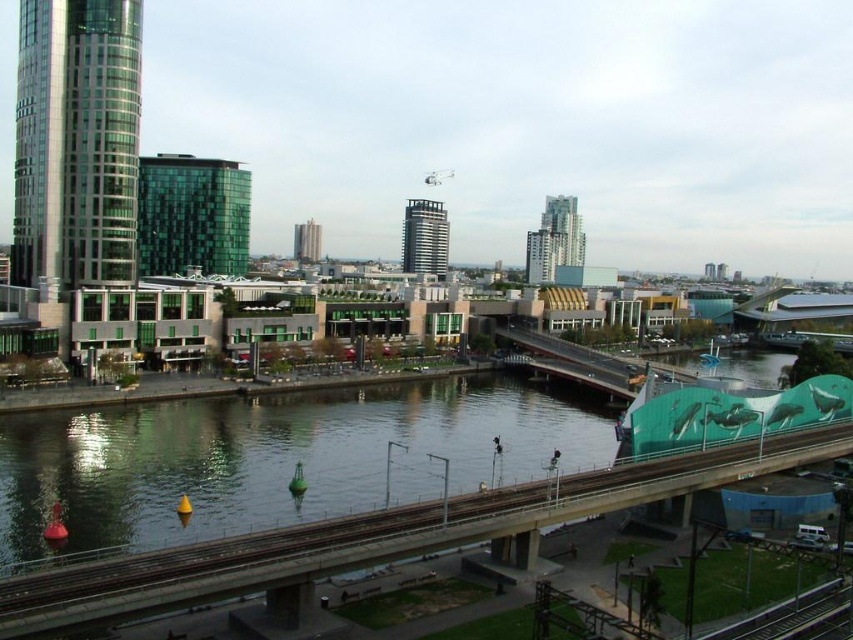
Find the location of a particular element. This screenshot has width=853, height=640. green glass building at upper left is located at coordinates (192, 216).

Which is more to the left, green glass building at upper left or green glass tower at center?

Positioned to the left is green glass tower at center.

Who is more distant from viewer, (x=155, y=198) or (x=310, y=228)?

The point (x=310, y=228) is behind.

You are a GUI agent. You are given a task and a screenshot of the screen. Output one action in this format:
    pyautogui.click(x=<x>, y=<y>)
    Task: Click on the green glass building at upper left
    The image size is (853, 640).
    Given the screenshot: What is the action you would take?
    pyautogui.click(x=192, y=216)

Is glassy concrete skyscraper at center below metallic glass tower at center?

Yes.

Is glassy concrete skyscraper at center positioned in front of metallic glass tower at center?

That is True.

This screenshot has height=640, width=853. Find the location of `glassy concrete skyscraper at center`. glassy concrete skyscraper at center is located at coordinates (554, 241).

Does clear water at center appear under glassy metallic skyscraper at left?

Yes.

Measure the distance between point [125,492] and camera.

Point [125,492] is 72.32 meters away from camera.

Find the location of a particular element. This screenshot has height=640, width=853. clear water at center is located at coordinates (270, 460).